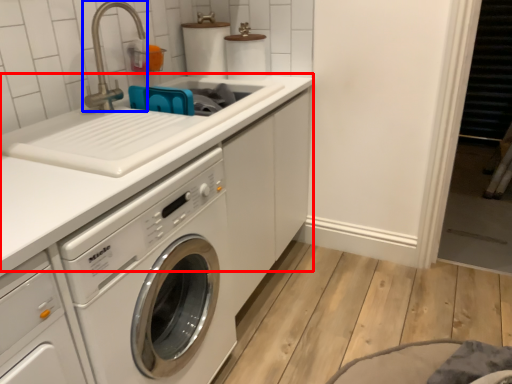
Question: Which object appears closest to the camera in this image, counter top (highlighted by a red box) or faucet (highlighted by a blue box)?

Choices:
 (A) counter top
 (B) faucet

Answer: (A)